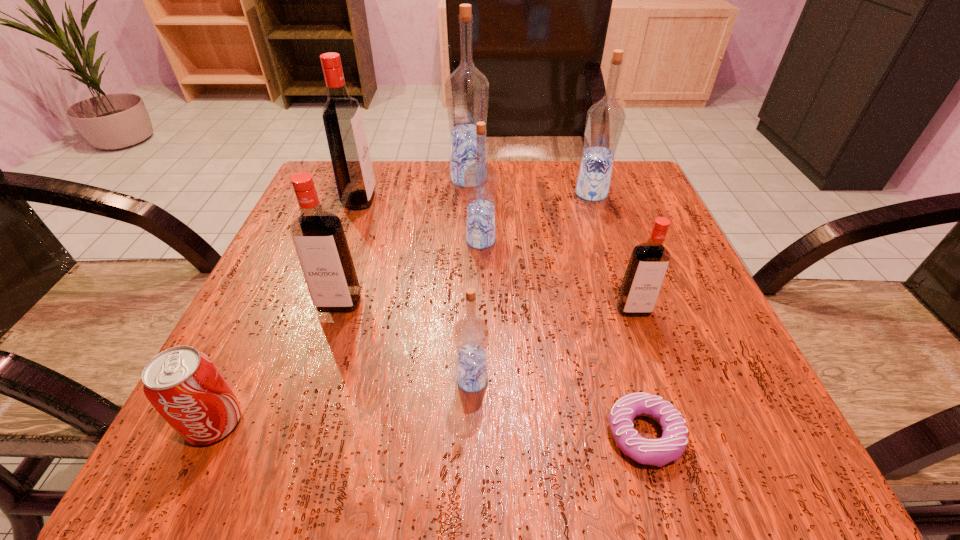
Locate an element on the screen. The image size is (960, 540). the tallest vodka is located at coordinates (466, 89).

At what (x,y) coordinates should I click in order to perform the action: click on the tallest object. Please return your answer as a coordinate pair (x, y). This screenshot has height=540, width=960. Looking at the image, I should click on (466, 89).

At what (x,y) coordinates should I click in order to perform the action: click on the rightmost blue vodka. Please return your answer as a coordinate pair (x, y). The height and width of the screenshot is (540, 960). Looking at the image, I should click on (605, 120).

I want to click on the farthest red vodka, so click(x=345, y=133).

Locate an element on the screen. This screenshot has width=960, height=540. the fourth farthest vodka is located at coordinates (480, 179).

Where is `the third farthest blue vodka`? This screenshot has height=540, width=960. the third farthest blue vodka is located at coordinates (480, 179).

The height and width of the screenshot is (540, 960). What are the coordinates of `the second smallest red vodka` in the screenshot? It's located at (319, 239).

This screenshot has width=960, height=540. In order to click on the rightmost red vodka in this screenshot , I will do `click(649, 261)`.

Identify the location of the smallest blue vodka. (471, 333).

Locate an element on the screen. The width and height of the screenshot is (960, 540). the nearest blue vodka is located at coordinates (471, 333).